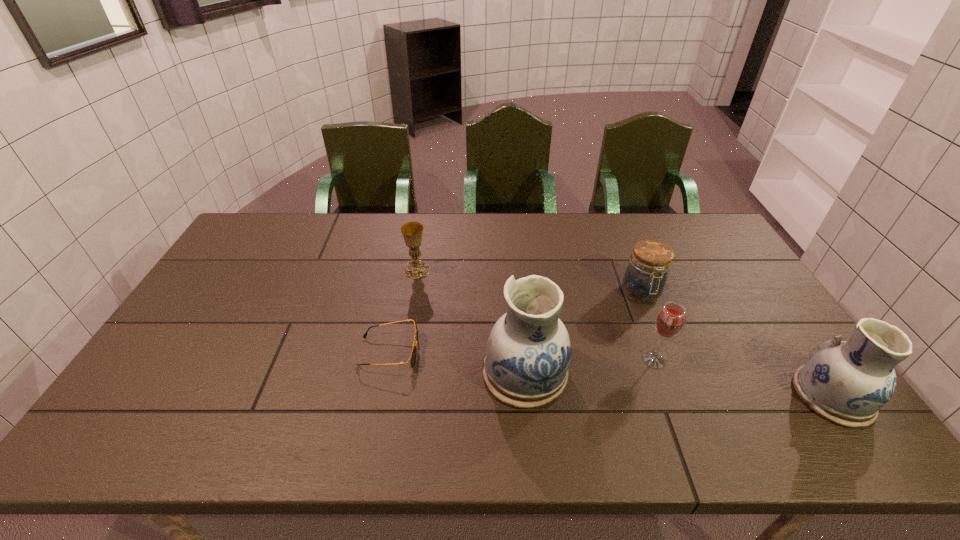
Find the location of `free space between the tallest object and the rightmost object`. free space between the tallest object and the rightmost object is located at coordinates (679, 384).

Where is `free space between the fifth shortest object and the taller pottery`? free space between the fifth shortest object and the taller pottery is located at coordinates (679, 384).

Locate an element on the screen. The width and height of the screenshot is (960, 540). free space that is in between the fourth object from right to left and the shorter pottery is located at coordinates (679, 384).

I want to click on vacant area that lies between the jar and the right pottery, so click(737, 345).

Identify the location of vacant space that's between the farthest object and the taller pottery. The width and height of the screenshot is (960, 540). (470, 321).

I want to click on free space between the second tallest object and the farthest object, so click(x=625, y=333).

This screenshot has height=540, width=960. I want to click on free area in between the left pottery and the jar, so click(583, 333).

The image size is (960, 540). I want to click on unoccupied area between the right pottery and the tallest object, so click(x=679, y=384).

Find the location of `object that stands as the second closest to the chalice`. object that stands as the second closest to the chalice is located at coordinates (528, 352).

Locate which object ranks second in proximity to the fifth shortest object. Please provide its 2D coordinates. Your answer should be formatted as a tuple, i.e. [(x, y)], where the tuple contains the x and y coordinates of a point satisfying the conditions above.

[(645, 277)]